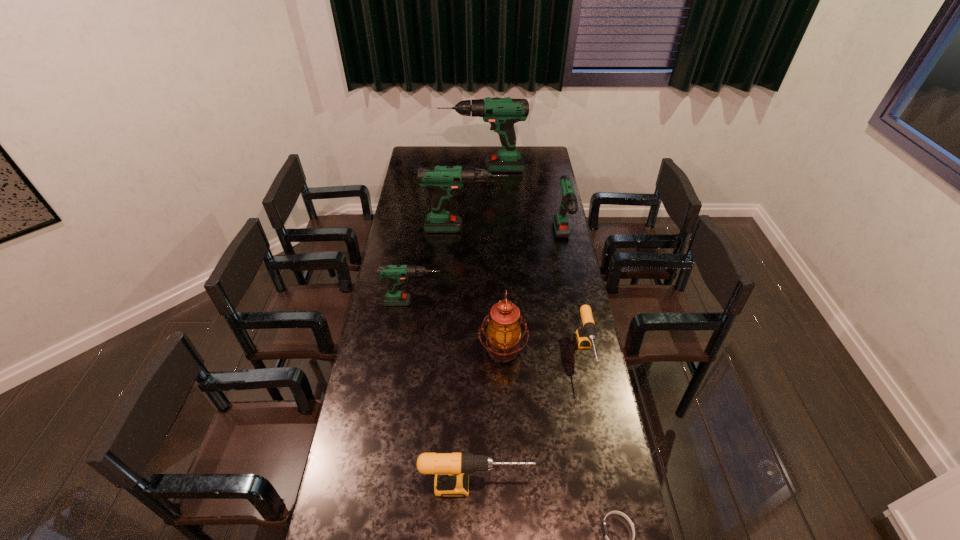
This screenshot has height=540, width=960. Find the location of `blank area located 0.250m on the handle side of the second nearest drill`. blank area located 0.250m on the handle side of the second nearest drill is located at coordinates (605, 447).

The image size is (960, 540). I want to click on object at the far edge, so click(502, 113).

Find the location of a particular element. free point at the left edge is located at coordinates (421, 212).

The width and height of the screenshot is (960, 540). What are the coordinates of `vacant space at the right edge of the desktop` in the screenshot? It's located at (546, 296).

This screenshot has height=540, width=960. I want to click on free space at the far left corner of the desktop, so click(424, 157).

This screenshot has width=960, height=540. Identify the location of vacant region at the far right corner of the desktop. (542, 148).

Locate an element on the screen. The image size is (960, 540). free space that is in between the fifth shortest object and the smallest green drill is located at coordinates (489, 272).

The height and width of the screenshot is (540, 960). Find the location of `free space between the second tallest drill and the oil lamp`. free space between the second tallest drill and the oil lamp is located at coordinates (484, 289).

You are a GUI agent. You are given a task and a screenshot of the screen. Output one action in this format:
    pyautogui.click(x=<x>, y=<y>)
    Task: Click on the vacant space that is in between the second smallest green drill and the second nearest drill
    
    Given the screenshot: What is the action you would take?
    pyautogui.click(x=574, y=297)

This screenshot has height=540, width=960. I want to click on vacant point located between the rightmost green drill and the smaller black drill, so click(x=574, y=297).